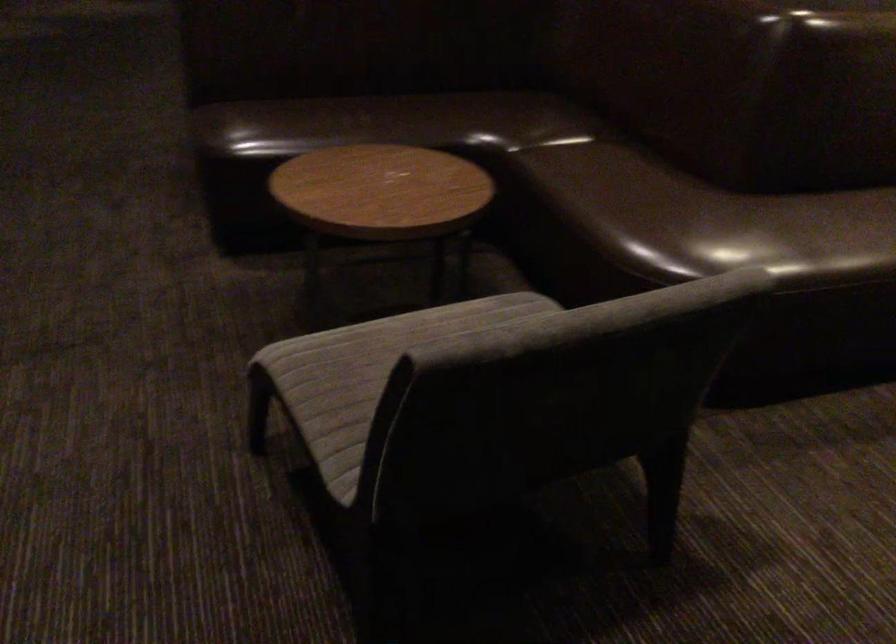
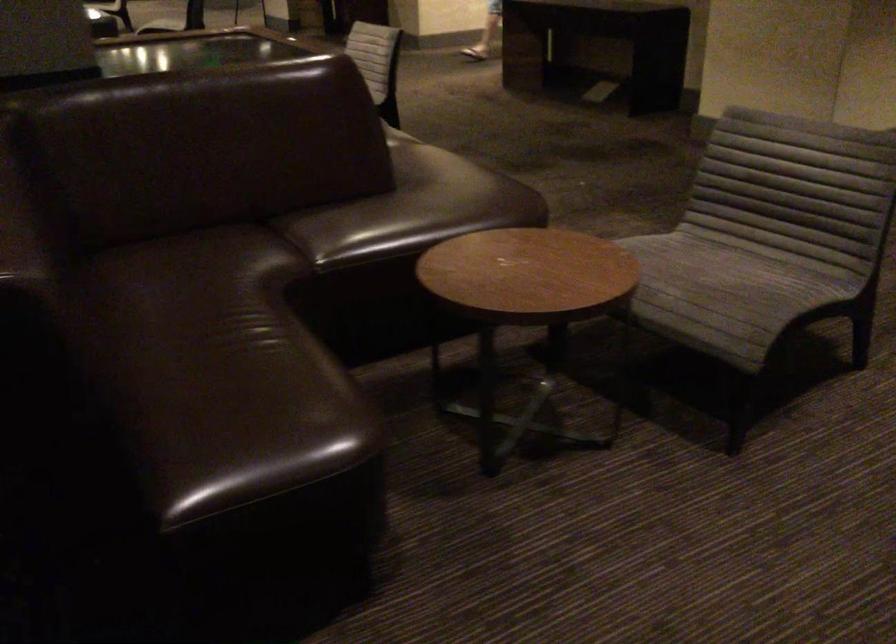
Where in the second image is the point corresponding to point 366,346 from the first image?

(722, 286)